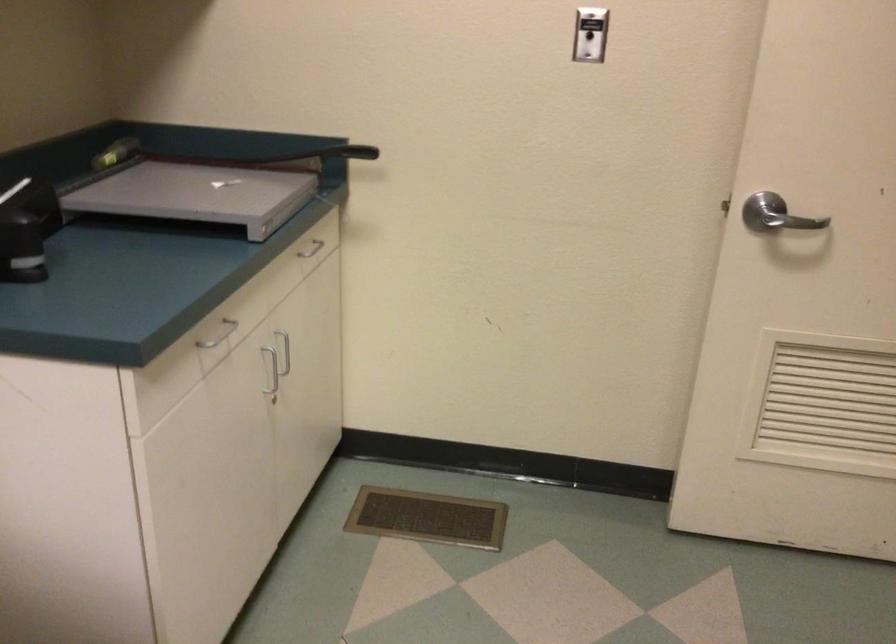
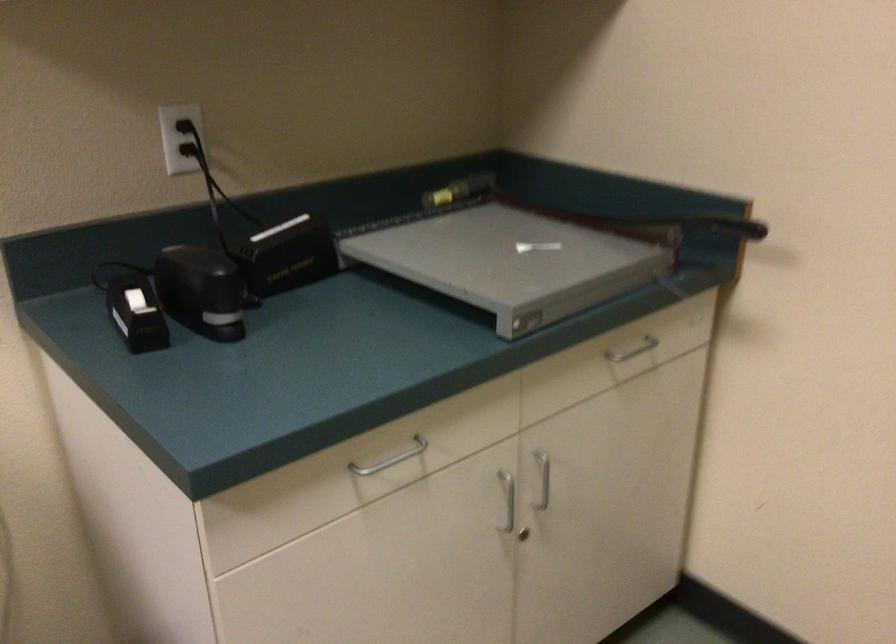
Locate, in the second image, the point that corresponds to point (270, 366) in the first image.

(507, 500)